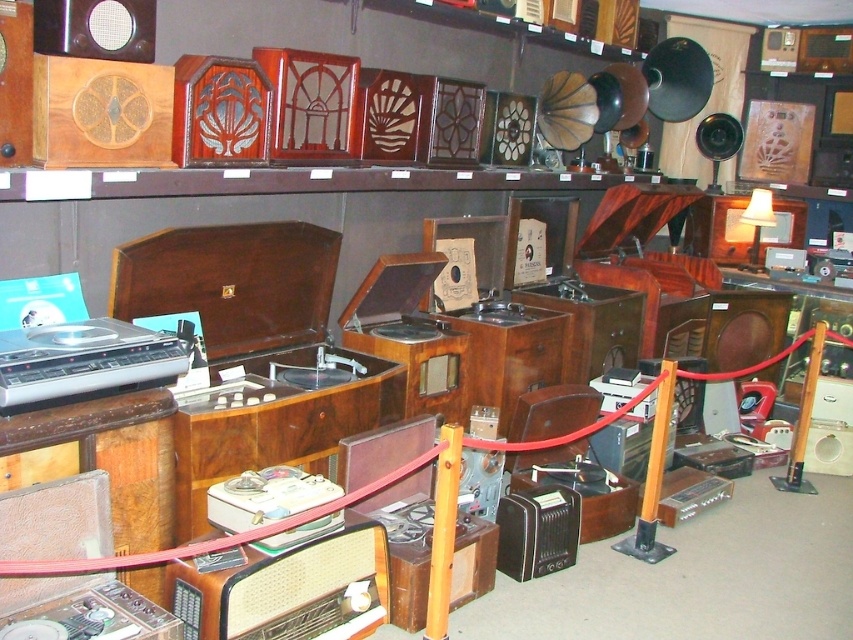
You are a delivery person who needs to place a new speaker that is 10 centimeters wide between the silver metallic turntable at left and the matte black speaker at upper left. Is there enough space between them to fit the new speaker?

The silver metallic turntable at left and matte black speaker at upper left are 91.25 centimeters apart, so yes, there is enough space to fit a new speaker that is only 10 centimeters wide between them.

You are an audio technician inspecting the vintage equipment. You need to locate the silver metallic turntable at left. Based on the coordinates provided, where exactly is it positioned on the top shelf?

The silver metallic turntable at left is located at point coordinates (86, 362) on the top shelf.

You are a museum visitor standing in front of the vintage audio equipment display. You notice the silver metallic turntable at left and the matte black speaker at upper left. Which object is closer to you?

The silver metallic turntable at left is closer to you because it is positioned in front of the matte black speaker at upper left.